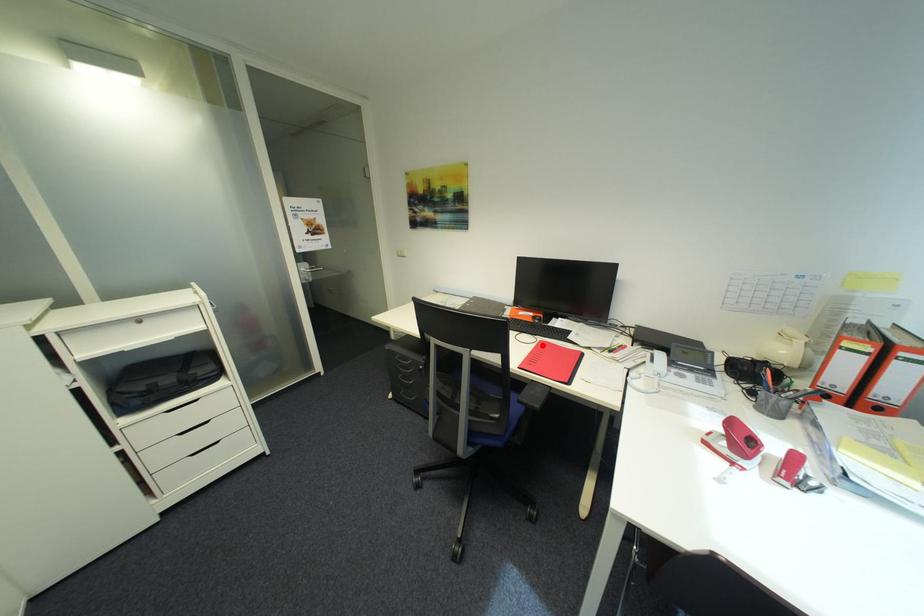
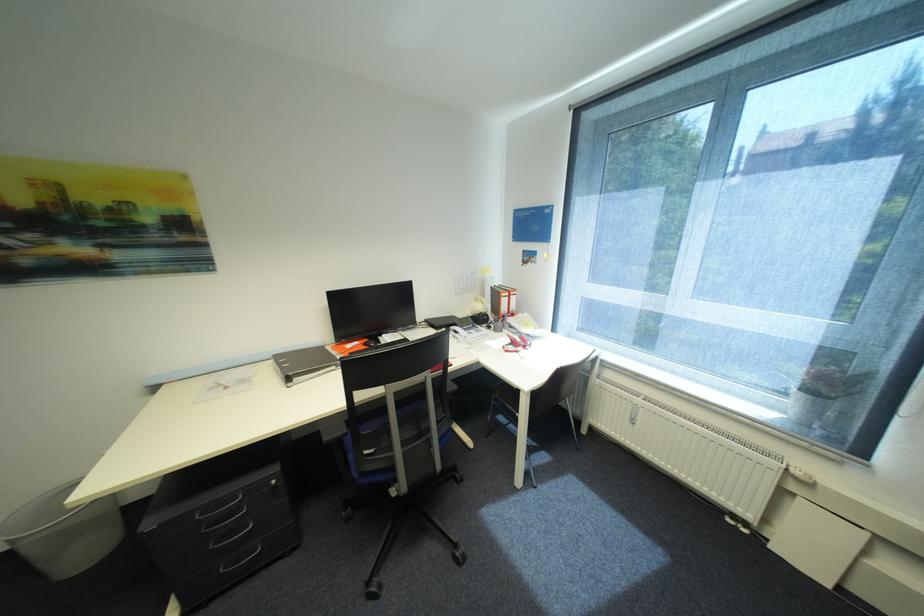
Question: I am providing you with two images of the same scene from different viewpoints. A red point is marked on the first image. Is the red point's position out of view in image 2?

Choices:
 (A) Yes
 (B) No

Answer: (A)